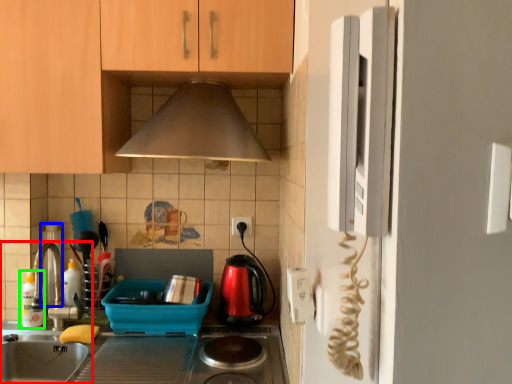
Question: Estimate the real-world distances between objects in this image. Which object is closer to home appliance (highlighted by a red box), appliance (highlighted by a blue box) or bottle (highlighted by a green box)?

Choices:
 (A) appliance
 (B) bottle

Answer: (B)